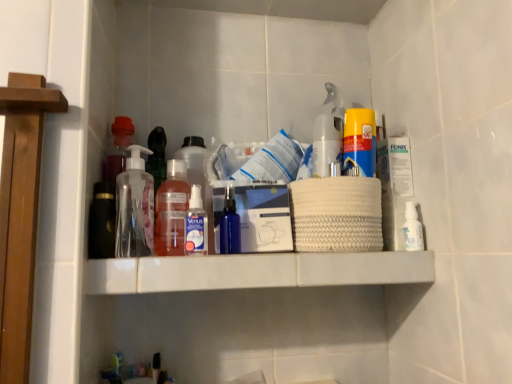
Question: Is transparent plastic pump bottle at center, placed as the 6th bottle when sorted from right to left, wider than translucent plastic bottle at center, which ranks as the 3th bottle in left-to-right order?

Choices:
 (A) yes
 (B) no

Answer: (A)

Question: Does transparent plastic pump bottle at center, placed as the 6th bottle when sorted from right to left, appear on the right side of translucent plastic bottle at center, which ranks as the 3th bottle in left-to-right order?

Choices:
 (A) yes
 (B) no

Answer: (B)

Question: Is translucent plastic bottle at center, which ranks as the 3th bottle in left-to-right order, a part of transparent plastic pump bottle at center, which is the first bottle in left-to-right order?

Choices:
 (A) no
 (B) yes

Answer: (A)

Question: Does transparent plastic pump bottle at center, which is the first bottle in left-to-right order, appear on the left side of translucent plastic bottle at center, which ranks as the 3th bottle in left-to-right order?

Choices:
 (A) no
 (B) yes

Answer: (B)

Question: Does transparent plastic pump bottle at center, placed as the 6th bottle when sorted from right to left, lie in front of translucent plastic bottle at center, placed as the fourth bottle when sorted from right to left?

Choices:
 (A) yes
 (B) no

Answer: (A)

Question: Considering the positions of white matte shelf at center and transparent plastic pump bottle at center, which is the first bottle in left-to-right order, in the image, is white matte shelf at center wider or thinner than transparent plastic pump bottle at center, which is the first bottle in left-to-right order,?

Choices:
 (A) wide
 (B) thin

Answer: (A)

Question: Is point (215, 286) closer or farther from the camera than point (131, 220)?

Choices:
 (A) farther
 (B) closer

Answer: (B)

Question: Considering the positions of white matte shelf at center and transparent plastic pump bottle at center, which is the first bottle in left-to-right order, in the image, is white matte shelf at center taller or shorter than transparent plastic pump bottle at center, which is the first bottle in left-to-right order,?

Choices:
 (A) short
 (B) tall

Answer: (A)

Question: Would you say white matte shelf at center is to the left or to the right of transparent plastic pump bottle at center, which is the first bottle in left-to-right order, in the picture?

Choices:
 (A) right
 (B) left

Answer: (A)

Question: Is white matte spray can at center, which ranks as the fifth bottle in left-to-right order, wider or thinner than transparent plastic pump bottle at center, which is the first bottle in left-to-right order?

Choices:
 (A) thin
 (B) wide

Answer: (A)

Question: In terms of size, does white matte spray can at center, which is counted as the 2th bottle, starting from the right, appear bigger or smaller than transparent plastic pump bottle at center, which is the first bottle in left-to-right order?

Choices:
 (A) small
 (B) big

Answer: (A)

Question: From their relative heights in the image, would you say white matte spray can at center, which ranks as the fifth bottle in left-to-right order, is taller or shorter than transparent plastic pump bottle at center, which is the first bottle in left-to-right order?

Choices:
 (A) short
 (B) tall

Answer: (A)

Question: Considering their positions, is white matte spray can at center, which is counted as the 2th bottle, starting from the right, located in front of or behind transparent plastic pump bottle at center, which is the first bottle in left-to-right order?

Choices:
 (A) front
 (B) behind

Answer: (B)

Question: From their relative heights in the image, would you say translucent plastic bottle at center, marked as the second bottle in a left-to-right arrangement, is taller or shorter than transparent plastic pump bottle at center, which is the first bottle in left-to-right order?

Choices:
 (A) short
 (B) tall

Answer: (A)

Question: Considering the relative positions of translucent plastic bottle at center, the 5th bottle in the right-to-left sequence, and transparent plastic pump bottle at center, which is the first bottle in left-to-right order, in the image provided, is translucent plastic bottle at center, the 5th bottle in the right-to-left sequence, to the left or to the right of transparent plastic pump bottle at center, which is the first bottle in left-to-right order,?

Choices:
 (A) left
 (B) right

Answer: (B)